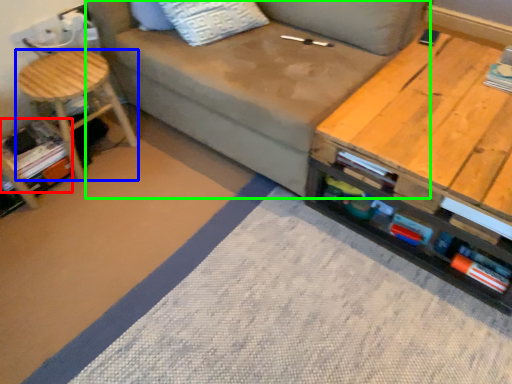
Question: Which is nearer to the book (highlighted by a red box)? stool (highlighted by a blue box) or studio couch (highlighted by a green box).

Choices:
 (A) stool
 (B) studio couch

Answer: (A)